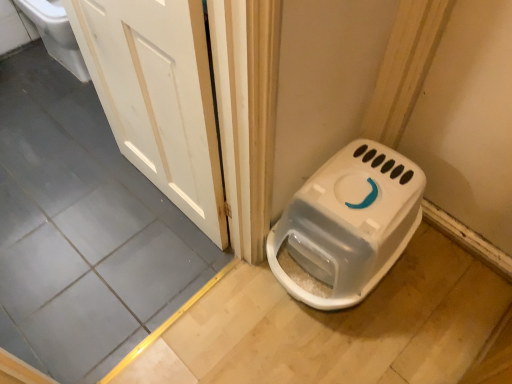
Find the location of a particular element. Image resolution: width=512 pixels, height=384 pixels. vacant space that is to the left of white wood door at upper left is located at coordinates (86, 193).